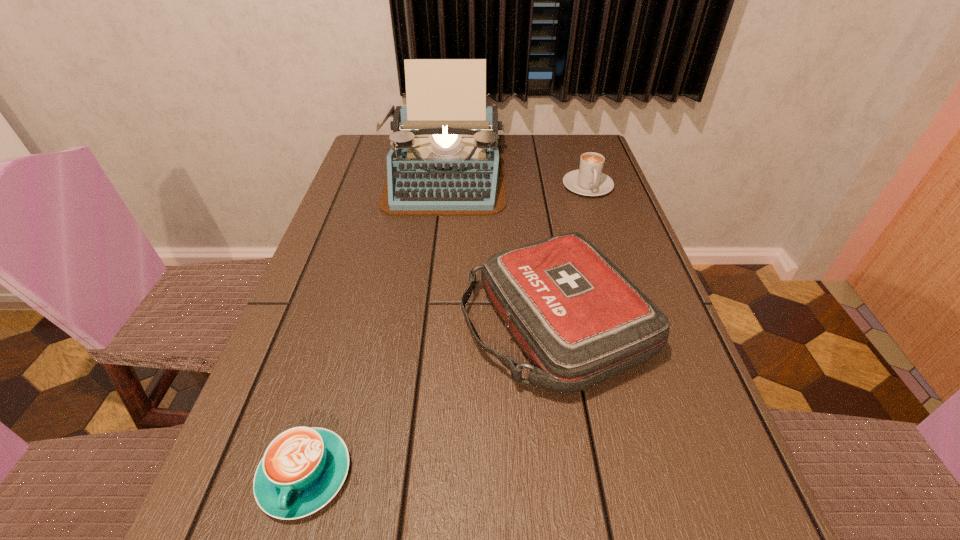
At what (x,y) coordinates should I click in order to perform the action: click on object that is at the far edge. Please return your answer as a coordinate pair (x, y). This screenshot has height=540, width=960. Looking at the image, I should click on (445, 160).

Locate an element on the screen. typewriter located at the left edge is located at coordinates (445, 160).

Identify the location of cappuccino present at the left edge. (303, 468).

Where is `the first-aid kit positioned at the right edge`? the first-aid kit positioned at the right edge is located at coordinates (580, 320).

At what (x,y) coordinates should I click in order to perform the action: click on cappuccino that is at the right edge. Please return your answer as a coordinate pair (x, y). Looking at the image, I should click on (588, 180).

I want to click on object that is at the far left corner, so click(x=445, y=160).

In the image, there is a desktop. At what (x,y) coordinates should I click in order to perform the action: click on vacant space at the far edge. Please return your answer as a coordinate pair (x, y). The height and width of the screenshot is (540, 960). Looking at the image, I should click on (524, 167).

You are a GUI agent. You are given a task and a screenshot of the screen. Output one action in this format:
    pyautogui.click(x=<x>, y=<y>)
    Task: Click on the vacant space at the left edge of the desktop
    Image resolution: width=960 pixels, height=540 pixels.
    Given the screenshot: What is the action you would take?
    pyautogui.click(x=346, y=266)

In the image, there is a desktop. Where is `vacant region at the right edge`? Image resolution: width=960 pixels, height=540 pixels. vacant region at the right edge is located at coordinates (722, 518).

You are a GUI agent. You are given a task and a screenshot of the screen. Output one action in this format:
    pyautogui.click(x=<x>, y=<y>)
    Task: Click on the vacant space at the far right corner
    This screenshot has height=540, width=960.
    Given the screenshot: What is the action you would take?
    pyautogui.click(x=603, y=155)